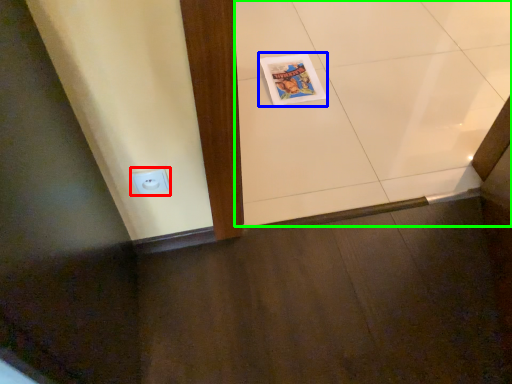
Question: Which object is the closest to the electric outlet (highlighted by a red box)? Choose among these: comic book (highlighted by a blue box) or ceramic tile (highlighted by a green box).

Choices:
 (A) comic book
 (B) ceramic tile

Answer: (A)